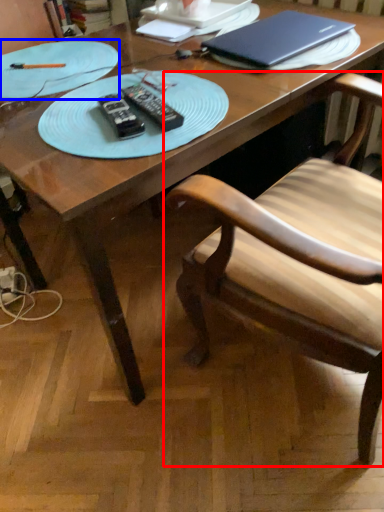
Question: Which object appears closest to the camera in this image, chair (highlighted by a red box) or plate (highlighted by a blue box)?

Choices:
 (A) chair
 (B) plate

Answer: (A)